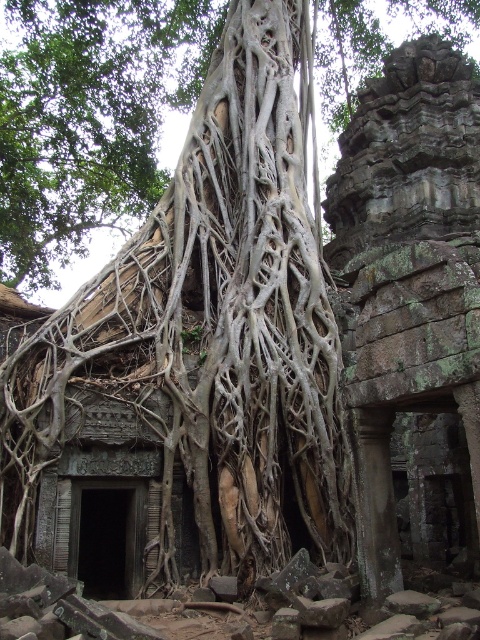
Can you confirm if gray textured roots at center is positioned to the left of white textured roots at center?

Incorrect, gray textured roots at center is not on the left side of white textured roots at center.

Can you confirm if gray textured roots at center is bigger than white textured roots at center?

Actually, gray textured roots at center might be smaller than white textured roots at center.

Does point (223, 433) lie in front of point (129, 12)?

That is True.

Image resolution: width=480 pixels, height=640 pixels. I want to click on gray textured roots at center, so click(x=211, y=330).